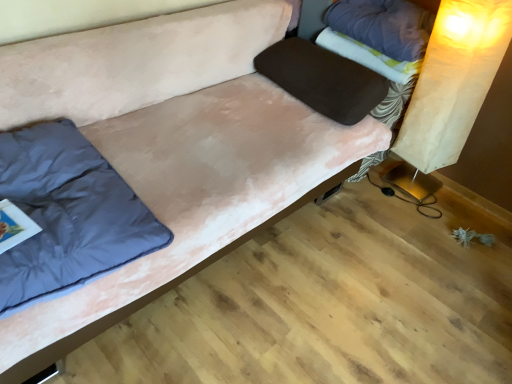
Find the location of a particular element. The width and height of the screenshot is (512, 384). free region under matte paper lampshade at right (from a real-world perspective) is located at coordinates (405, 184).